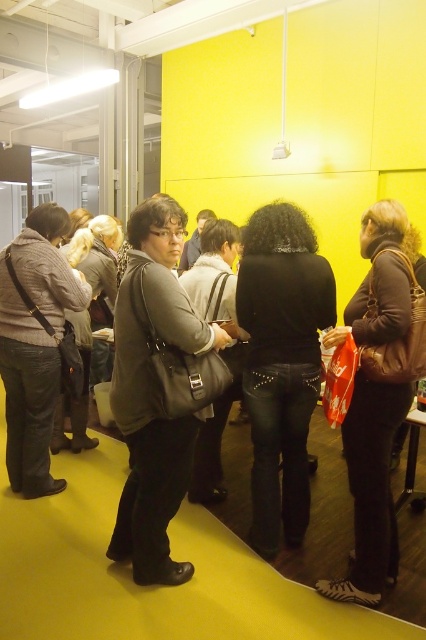
Question: Estimate the real-world distances between objects in this image. Which object is closer to the matte black bag at center?

Choices:
 (A) knit sweater at left
 (B) black leather bag at center

Answer: (A)

Question: Which point is farther from the camera taking this photo?

Choices:
 (A) (267, 397)
 (B) (314, 496)
 (C) (348, 442)

Answer: (B)

Question: Considering the relative positions of black studded jeans at center and brown leather jacket at center in the image provided, where is black studded jeans at center located with respect to brown leather jacket at center?

Choices:
 (A) above
 (B) below

Answer: (A)

Question: Is matte black bag at center closer to camera compared to matte black jacket at center?

Choices:
 (A) yes
 (B) no

Answer: (A)

Question: Does brown leather jacket at center lie in front of matte black jacket at center?

Choices:
 (A) no
 (B) yes

Answer: (B)

Question: Which is nearer to the knit sweater at left?

Choices:
 (A) black leather bag at center
 (B) matte black jacket at center
 (C) matte black bag at center
 (D) brown leather jacket at center

Answer: (B)